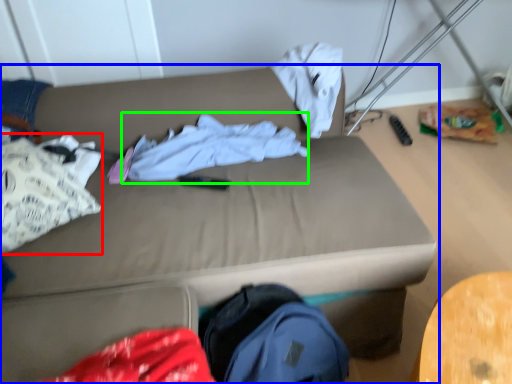
Question: Which object is positioned farthest from clothing (highlighted by a red box)? Select from studio couch (highlighted by a blue box) and clothing (highlighted by a green box).

Choices:
 (A) studio couch
 (B) clothing

Answer: (B)